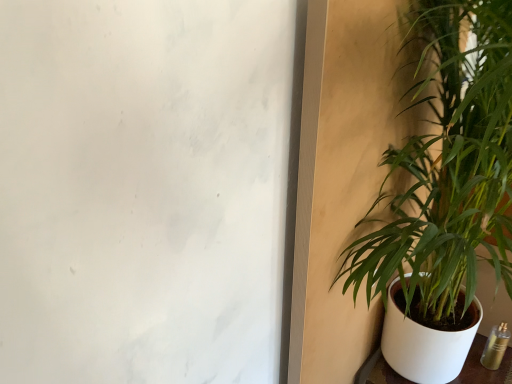
Question: Is white ceramic flowerpot at right wider than green leafy plant at right?

Choices:
 (A) no
 (B) yes

Answer: (B)

Question: Is white ceramic flowerpot at right completely or partially outside of green leafy plant at right?

Choices:
 (A) no
 (B) yes

Answer: (B)

Question: Is green leafy plant at right at the back of white ceramic flowerpot at right?

Choices:
 (A) yes
 (B) no

Answer: (B)

Question: Is white ceramic flowerpot at right shorter than green leafy plant at right?

Choices:
 (A) no
 (B) yes

Answer: (B)

Question: Considering the relative sizes of white ceramic flowerpot at right and green leafy plant at right in the image provided, is white ceramic flowerpot at right taller than green leafy plant at right?

Choices:
 (A) yes
 (B) no

Answer: (B)

Question: Is the position of white ceramic flowerpot at right more distant than that of green leafy plant at right?

Choices:
 (A) no
 (B) yes

Answer: (B)

Question: Is green leafy plant at right positioned in front of white ceramic flowerpot at right?

Choices:
 (A) yes
 (B) no

Answer: (A)

Question: Would you say green leafy plant at right contains white ceramic flowerpot at right?

Choices:
 (A) no
 (B) yes

Answer: (A)

Question: Is green leafy plant at right positioned beyond the bounds of white ceramic flowerpot at right?

Choices:
 (A) no
 (B) yes

Answer: (B)

Question: From a real-world perspective, is green leafy plant at right below white ceramic flowerpot at right?

Choices:
 (A) no
 (B) yes

Answer: (A)

Question: Considering the relative sizes of green leafy plant at right and white ceramic flowerpot at right in the image provided, is green leafy plant at right shorter than white ceramic flowerpot at right?

Choices:
 (A) yes
 (B) no

Answer: (B)

Question: Is green leafy plant at right not near white ceramic flowerpot at right?

Choices:
 (A) yes
 (B) no

Answer: (B)

Question: Considering the positions of point (387, 160) and point (395, 279), is point (387, 160) closer or farther from the camera than point (395, 279)?

Choices:
 (A) closer
 (B) farther

Answer: (A)